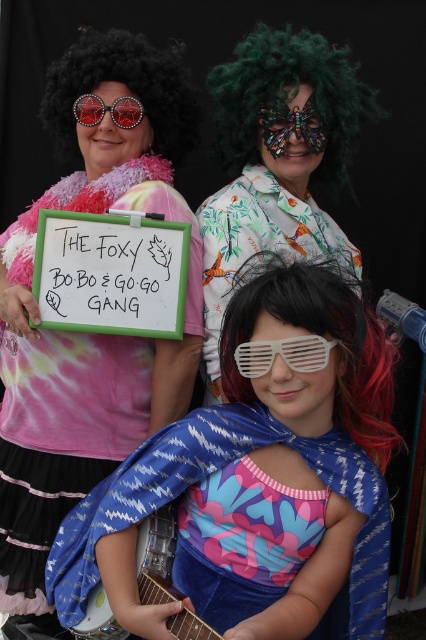
In the scene shown: Is shiny blue cape at center shorter than green curly wig at upper center?

In fact, shiny blue cape at center may be taller than green curly wig at upper center.

From the picture: Measure the distance between shiny blue cape at center and camera.

shiny blue cape at center and camera are 4.99 feet apart.

I want to click on shiny blue cape at center, so click(x=259, y=483).

Between green feather boa at upper center and white plastic goggles at center, which one has less height?

white plastic goggles at center

Measure the distance between green feather boa at upper center and camera.

green feather boa at upper center is 2.20 meters away from camera.

This screenshot has width=426, height=640. I want to click on green feather boa at upper center, so click(x=276, y=160).

In the scene shown: Can you confirm if metallic guitar at lower center is wider than white plastic goggles at center?

Yes.

Who is taller, metallic guitar at lower center or white plastic goggles at center?

With more height is metallic guitar at lower center.

Is point (155, 552) positioned before point (308, 348)?

No.

Identify the location of metallic guitar at lower center. The width and height of the screenshot is (426, 640). (x=155, y=554).